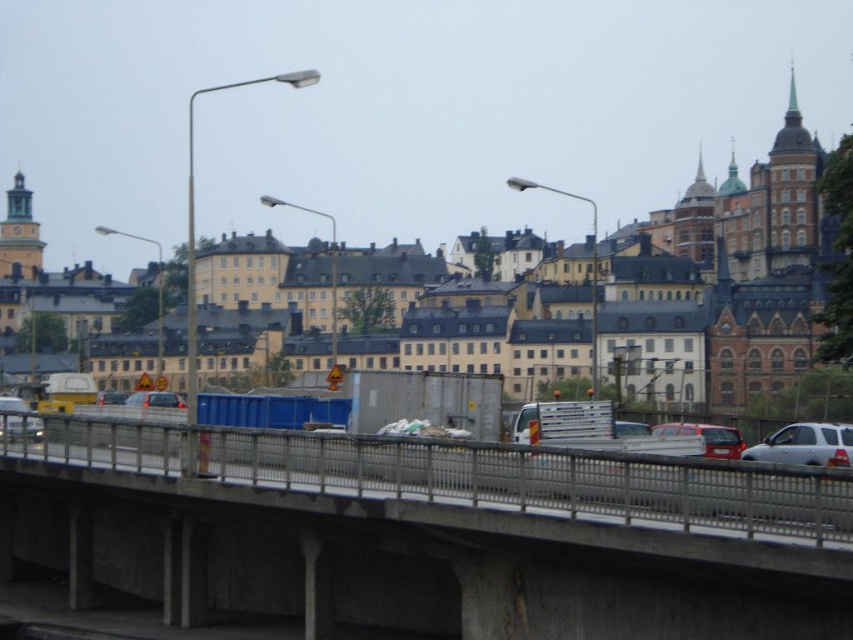
The height and width of the screenshot is (640, 853). What do you see at coordinates (427, 536) in the screenshot?
I see `concrete bridge at center` at bounding box center [427, 536].

Which of these two, concrete bridge at center or metallic silver car at center, stands shorter?

With less height is metallic silver car at center.

Locate an element on the screen. This screenshot has height=640, width=853. concrete bridge at center is located at coordinates (427, 536).

Find the location of a particular element. The width and height of the screenshot is (853, 640). concrete bridge at center is located at coordinates (427, 536).

The height and width of the screenshot is (640, 853). Describe the element at coordinates (427, 536) in the screenshot. I see `concrete bridge at center` at that location.

Which is below, concrete bridge at center or silver metallic car at lower right?

concrete bridge at center is lower down.

The width and height of the screenshot is (853, 640). I want to click on concrete bridge at center, so click(427, 536).

You are a GUI agent. You are given a task and a screenshot of the screen. Output one action in this format:
    pyautogui.click(x=<x>, y=<y>)
    Task: Click on the concrete bridge at center
    
    Given the screenshot: What is the action you would take?
    pyautogui.click(x=427, y=536)

Can you confirm if metallic silver car at center is positioned to the right of matte silver car at center?

No, metallic silver car at center is not to the right of matte silver car at center.

Who is more distant from viewer, [10,436] or [160,400]?

The point [160,400] is more distant.

Where is `metallic silver car at center`? Image resolution: width=853 pixels, height=640 pixels. metallic silver car at center is located at coordinates (20, 426).